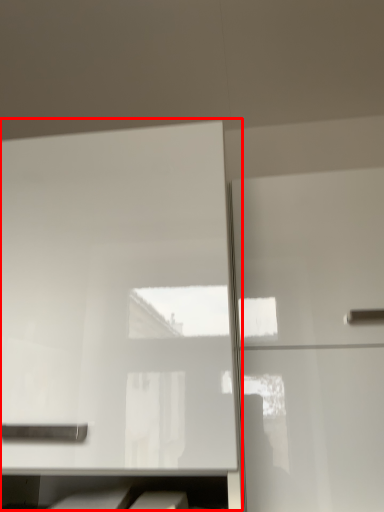
Question: Observing the image, what is the correct spatial positioning of cabinetry (annotated by the red box) in reference to cabinetry?

Choices:
 (A) right
 (B) left

Answer: (B)